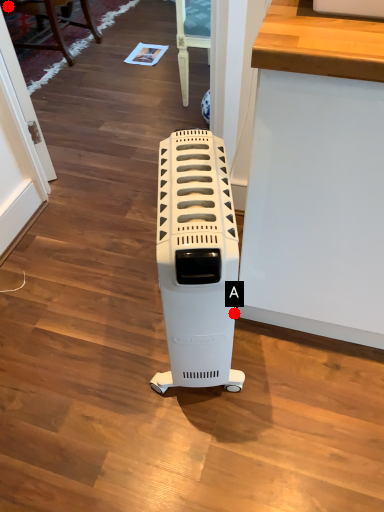
Question: Two points are circled on the image, labeled by A and B beside each circle. Which point is closer to the camera taking this photo?

Choices:
 (A) A is closer
 (B) B is closer

Answer: (A)